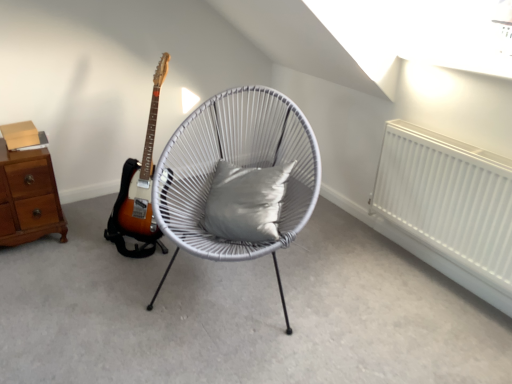
Question: From the image's perspective, is white matte radiator at right located above or below brown wood chest of drawers at left?

Choices:
 (A) below
 (B) above

Answer: (A)

Question: Considering the relative positions of white matte radiator at right and brown wood chest of drawers at left in the image provided, is white matte radiator at right to the left or to the right of brown wood chest of drawers at left?

Choices:
 (A) left
 (B) right

Answer: (B)

Question: Estimate the real-world distances between objects in this image. Which object is closer to the brown wood chest of drawers at left?

Choices:
 (A) gray fabric pillow at center
 (B) white matte radiator at right
 (C) white woven chair at center

Answer: (C)

Question: Which of these objects is positioned farthest from the white matte radiator at right?

Choices:
 (A) gray fabric pillow at center
 (B) brown wood chest of drawers at left
 (C) white woven chair at center

Answer: (B)